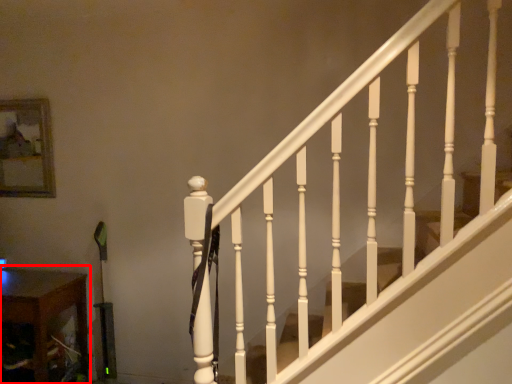
Question: Considering the relative positions of table (annotated by the red box) and picture frame in the image provided, where is table (annotated by the red box) located with respect to the staircase?

Choices:
 (A) left
 (B) right

Answer: (B)